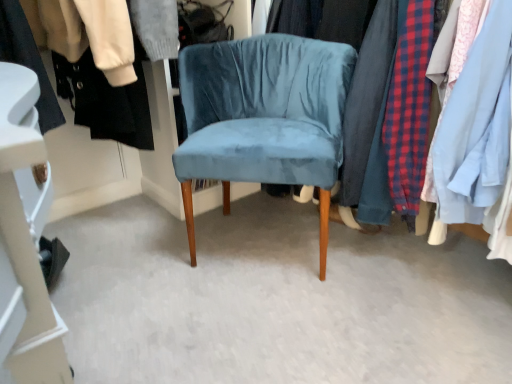
Locate an element on the screen. The width and height of the screenshot is (512, 384). empty space that is in between velvet blue chair at center and black fabric shoe at lower left, positioned as the 2th closet in right-to-left order is located at coordinates (155, 268).